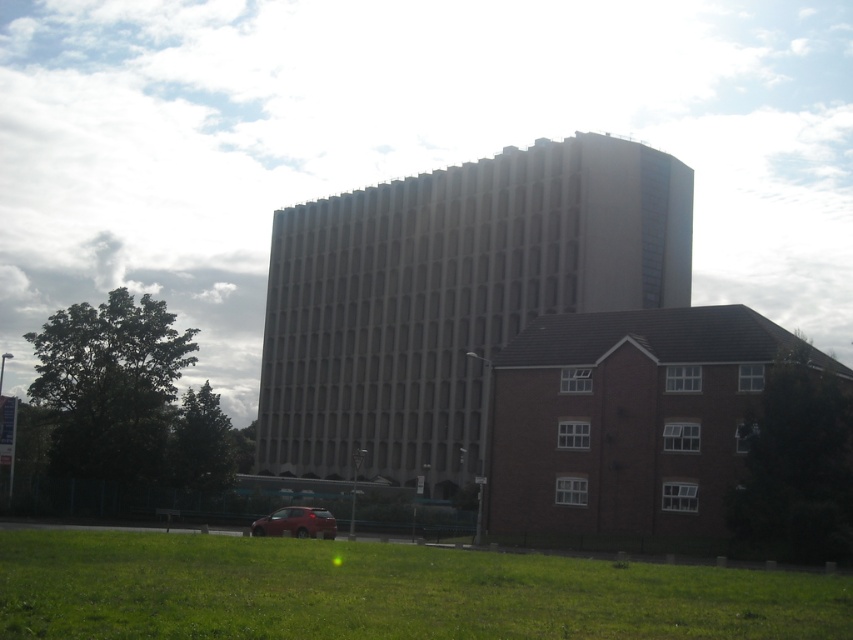
You are a gardener who needs to mow the lawn. You see the green grass at lower center and the metallic red hatchback at lower center. Which object is taller and requires more attention for mowing?

The green grass at lower center is taller than the metallic red hatchback at lower center, so it requires more attention for mowing.